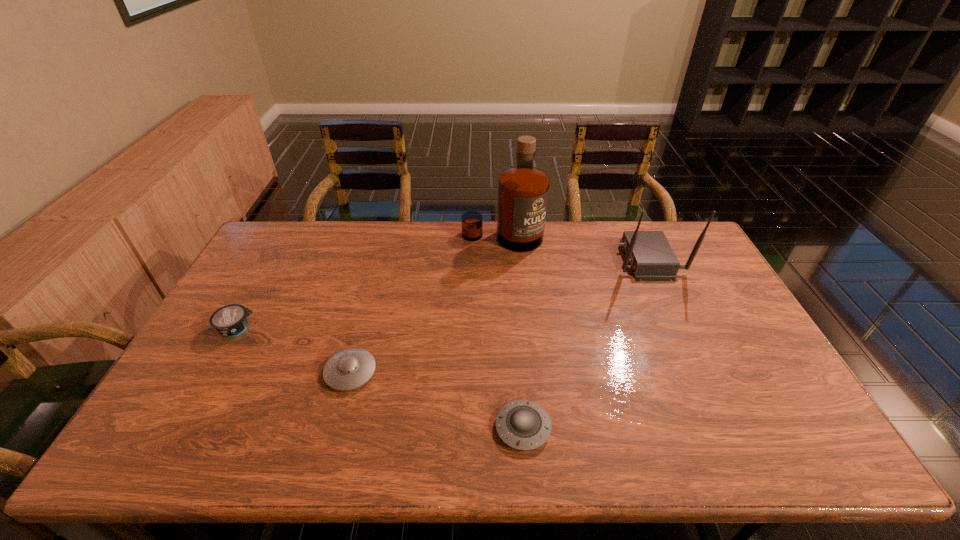
Where is `object that is at the right edge`? object that is at the right edge is located at coordinates (649, 253).

Where is `object that is at the far right corner`? This screenshot has height=540, width=960. object that is at the far right corner is located at coordinates coord(649,253).

You are a GUI agent. You are given a task and a screenshot of the screen. Output one action in this format:
    pyautogui.click(x=<x>, y=<y>)
    Task: Click on the vacant space at the far edge of the desktop
    This screenshot has width=960, height=540.
    Given the screenshot: What is the action you would take?
    pyautogui.click(x=366, y=246)

I want to click on vacant space at the near edge, so click(x=309, y=431).

Image resolution: width=960 pixels, height=540 pixels. Find the location of `free location at the far right corner`. free location at the far right corner is located at coordinates (683, 231).

Locate an element on the screen. free area in between the second shortest object and the rightmost object is located at coordinates (499, 316).

You are a GUI agent. You are given a task and a screenshot of the screen. Output one action in this format:
    pyautogui.click(x=<x>, y=<y>)
    Task: Click on the vacant space in between the liquor and the rightmost object
    Image resolution: width=960 pixels, height=540 pixels.
    Given the screenshot: What is the action you would take?
    pyautogui.click(x=575, y=249)

Identify the location of free spot between the liquor and the third tallest object. (370, 284).

Locate an element on the screen. This screenshot has height=540, width=960. empty space between the liquor and the second shortest object is located at coordinates (426, 305).

At what (x,y) coordinates should I click in order to perform the action: click on free spot between the yogurt and the shortest object. Please return your answer as a coordinate pair (x, y). The width and height of the screenshot is (960, 540). Looking at the image, I should click on (380, 379).